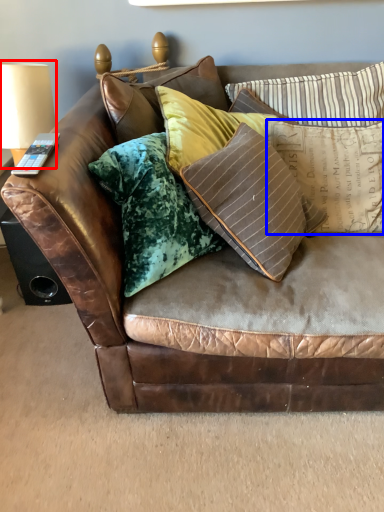
Question: Among these objects, which one is farthest to the camera, table lamp (highlighted by a red box) or pillow (highlighted by a blue box)?

Choices:
 (A) table lamp
 (B) pillow

Answer: (A)